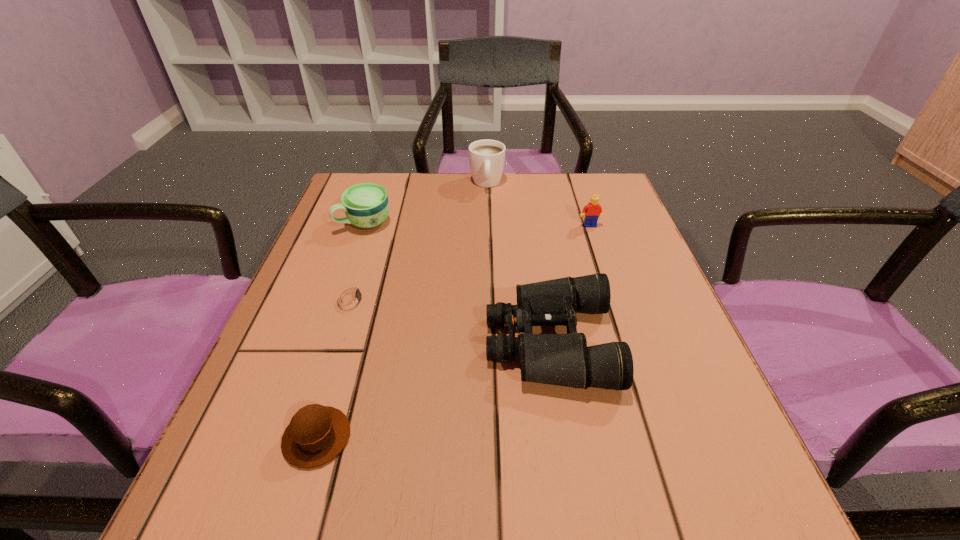
This screenshot has width=960, height=540. Find the location of `cappuccino`. cappuccino is located at coordinates (486, 157).

This screenshot has height=540, width=960. Find the location of `the farthest object`. the farthest object is located at coordinates 486,157.

Where is `Lego`? The height and width of the screenshot is (540, 960). Lego is located at coordinates (593, 210).

You are a GUI agent. You are given a task and a screenshot of the screen. Output one action in this format:
    pyautogui.click(x=<x>, y=<y>)
    Task: Click on the cup
    The image size is (960, 540).
    Given the screenshot: What is the action you would take?
    pyautogui.click(x=366, y=205)

This screenshot has height=540, width=960. I want to click on binoculars, so (x=557, y=359).

You are a GUI agent. You are given a task and a screenshot of the screen. Output one action in this format:
    pyautogui.click(x=<x>, y=<y>)
    Task: Click on the fifth tallest object
    
    Given the screenshot: What is the action you would take?
    pyautogui.click(x=316, y=434)

Where is `muffin`? muffin is located at coordinates (316, 434).

Where is `watch`? The height and width of the screenshot is (540, 960). watch is located at coordinates pos(351,299).

Image resolution: width=960 pixels, height=540 pixels. I want to click on vacant space situated 0.210m with the handle on the side of the tallest object, so click(x=489, y=244).

Where is `free point located 0.200m on the face of the Lego`? free point located 0.200m on the face of the Lego is located at coordinates (610, 285).